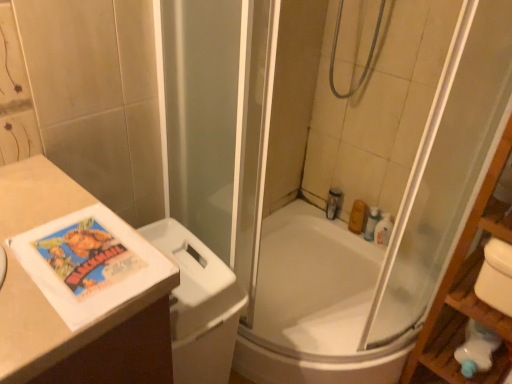
Image resolution: width=512 pixels, height=384 pixels. Identify the location of vacant space to the left of metallic silver toiletry at upper right, marked as the 4th toiletry in a right-to-left arrangement. (304, 208).